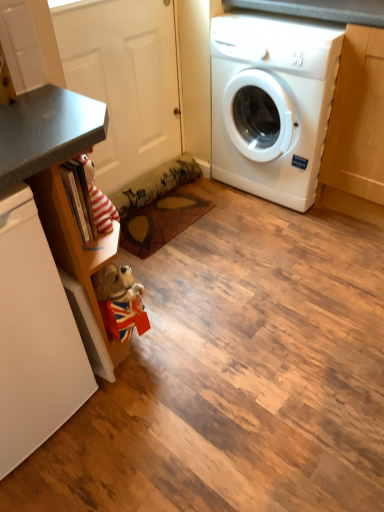
Question: Does white glossy washing machine at right come behind white matte dishwasher at left?

Choices:
 (A) no
 (B) yes

Answer: (B)

Question: Is the position of white glossy washing machine at right less distant than that of white matte dishwasher at left?

Choices:
 (A) yes
 (B) no

Answer: (B)

Question: Is white glossy washing machine at right positioned with its back to white matte dishwasher at left?

Choices:
 (A) no
 (B) yes

Answer: (A)

Question: Is white matte dishwasher at left inside white glossy washing machine at right?

Choices:
 (A) yes
 (B) no

Answer: (B)

Question: Does white glossy washing machine at right appear on the left side of white matte dishwasher at left?

Choices:
 (A) yes
 (B) no

Answer: (B)

Question: Can you confirm if white glossy washing machine at right is taller than white matte dishwasher at left?

Choices:
 (A) yes
 (B) no

Answer: (A)

Question: Can you confirm if white matte dishwasher at left is positioned to the right of white glossy washing machine at right?

Choices:
 (A) yes
 (B) no

Answer: (B)

Question: Does white matte dishwasher at left have a greater width compared to white glossy washing machine at right?

Choices:
 (A) no
 (B) yes

Answer: (B)

Question: Is white matte dishwasher at left further to the viewer compared to white glossy washing machine at right?

Choices:
 (A) no
 (B) yes

Answer: (A)

Question: Does white matte dishwasher at left have a larger size compared to white glossy washing machine at right?

Choices:
 (A) no
 (B) yes

Answer: (A)

Question: Is white matte dishwasher at left with white glossy washing machine at right?

Choices:
 (A) no
 (B) yes

Answer: (A)

Question: Considering the relative sizes of white matte dishwasher at left and white glossy washing machine at right in the image provided, is white matte dishwasher at left thinner than white glossy washing machine at right?

Choices:
 (A) no
 (B) yes

Answer: (A)

Question: Is white glossy washing machine at right wider or thinner than white matte dishwasher at left?

Choices:
 (A) wide
 (B) thin

Answer: (B)